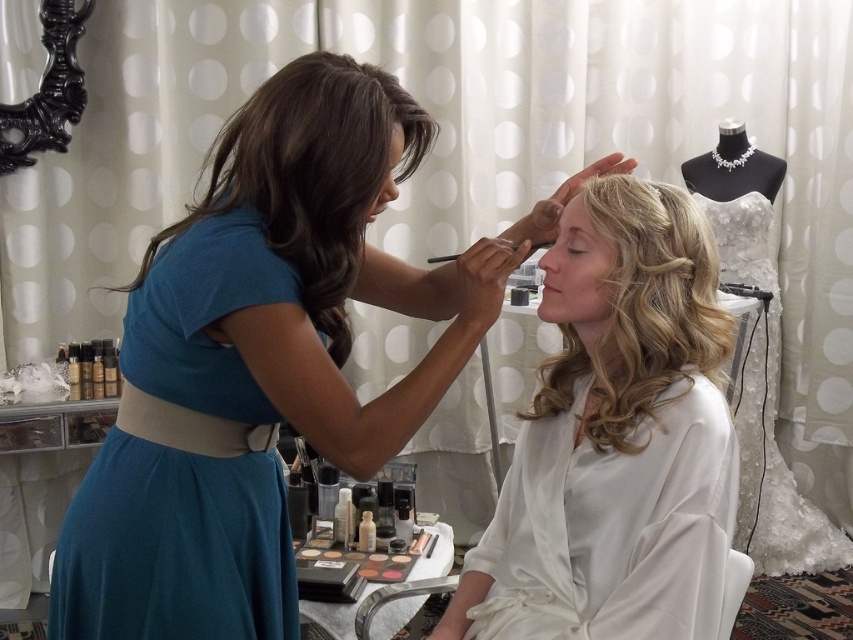
Question: Does dark brown silky hair at upper center appear over white lace dress at right?

Choices:
 (A) yes
 (B) no

Answer: (A)

Question: Is dark brown silky hair at upper center positioned before white lace dress at right?

Choices:
 (A) yes
 (B) no

Answer: (A)

Question: Which is nearer to the teal satin dress at upper left?

Choices:
 (A) silky white robe at center
 (B) blonde curly hair at center
 (C) teal satin dress at left

Answer: (C)

Question: Does teal satin dress at left lie behind blonde curly hair at center?

Choices:
 (A) no
 (B) yes

Answer: (A)

Question: Which point is farther to the camera?

Choices:
 (A) blonde curly hair at center
 (B) white lace dress at right
 (C) dark brown silky hair at upper center
 (D) silky white robe at center

Answer: (B)

Question: Which point is farther to the camera?

Choices:
 (A) (143, 433)
 (B) (167, 452)
 (C) (688, 408)

Answer: (C)